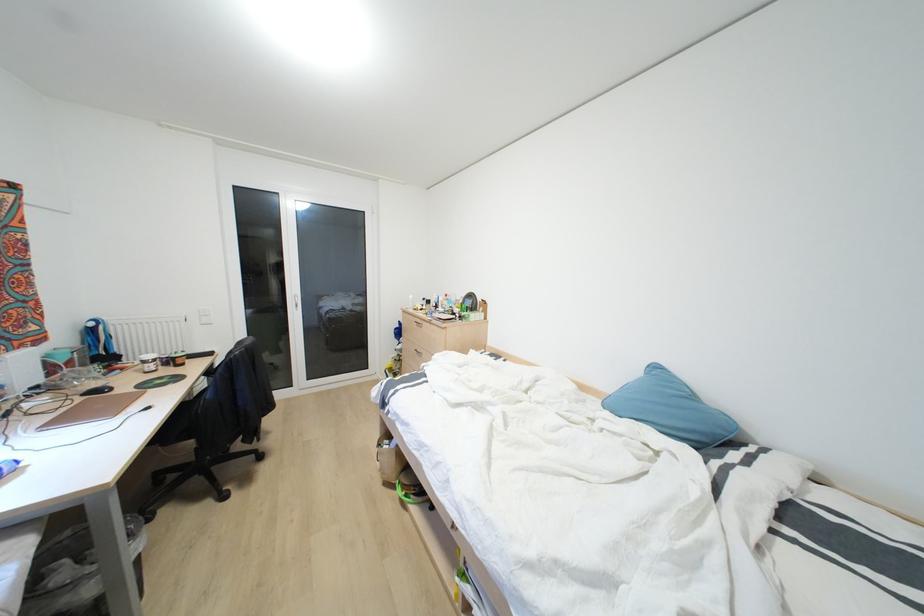
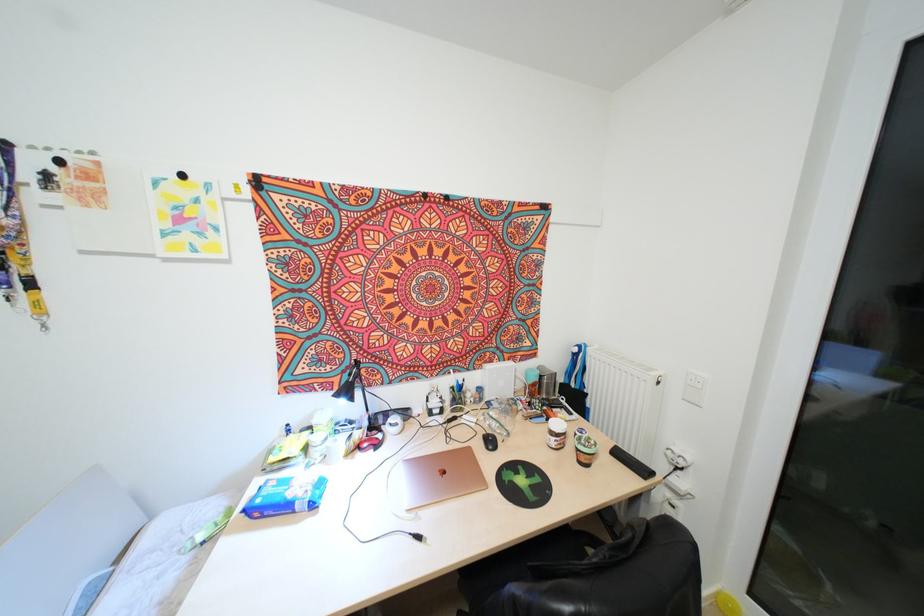
Find the pixel in the second image that matches [111,389] in the first image.

(494, 448)